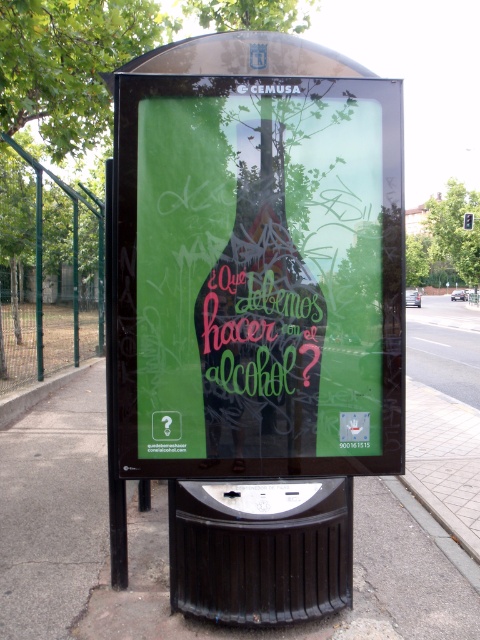
Question: Can you confirm if green matte poster at center is positioned above neon green glass bottle at center?

Choices:
 (A) no
 (B) yes

Answer: (B)

Question: Which point is farther from the camera taking this photo?

Choices:
 (A) (349, 372)
 (B) (108, 600)
 (C) (315, 353)

Answer: (B)

Question: Which point is closer to the camera taking this photo?

Choices:
 (A) (257, 232)
 (B) (212, 364)
 (C) (81, 387)

Answer: (A)

Question: Which object is positioned farthest from the black asphalt pavement at lower center?

Choices:
 (A) green matte poster at center
 (B) neon green glass bottle at center

Answer: (A)

Question: From the image, what is the correct spatial relationship of black asphalt pavement at lower center in relation to neon green glass bottle at center?

Choices:
 (A) above
 (B) below

Answer: (B)

Question: Can you confirm if black asphalt pavement at lower center is positioned to the left of neon green glass bottle at center?

Choices:
 (A) no
 (B) yes

Answer: (B)